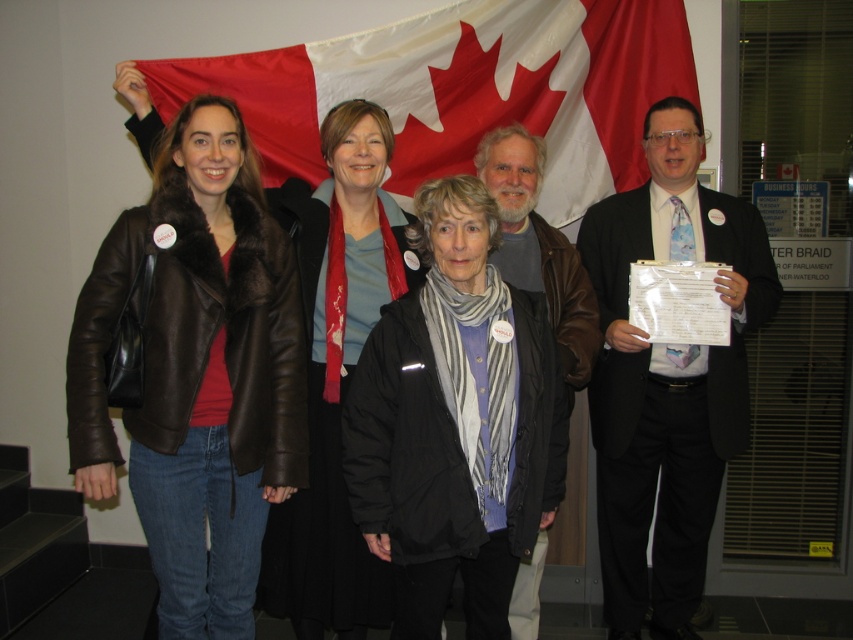
You are a photographer adjusting the camera settings for a group photo. The group includes a matte black suit at center and a matte brown leather jacket at center. To ensure both subjects are in focus, what is the minimum distance you need to set the depth of field? Use the distance between them as a reference.

The distance between the matte black suit at center and the matte brown leather jacket at center is 34.41 inches. To ensure both are in focus, set the depth of field so that it covers at least this distance.

You are organizing a photo shoot and need to ensure that the matte black suit at center and the matte brown leather jacket at center are visible in the frame. Given that the camera has a limited zoom range, which of the two items should you prioritize positioning closer to the camera to ensure clarity?

The matte black suit at center is bigger than the matte brown leather jacket at center, so you should prioritize positioning the matte black suit at center closer to the camera to ensure clarity.

Based on the provided scene description, where is the black woolen jacket at center located in terms of coordinates?

The black woolen jacket at center is located at coordinates point (456, 422).